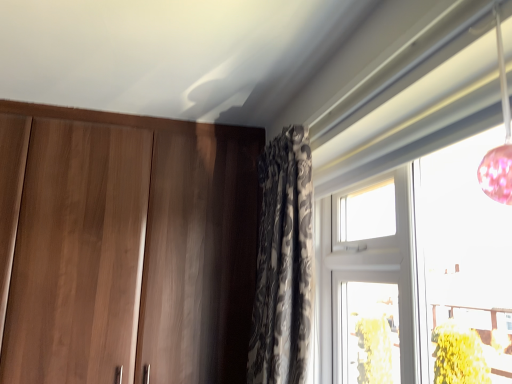
What do you see at coordinates (283, 262) in the screenshot? I see `patterned fabric curtain at center` at bounding box center [283, 262].

Identify the location of patterned fabric curtain at center. (283, 262).

Locate an element on the screen. patterned fabric curtain at center is located at coordinates click(283, 262).